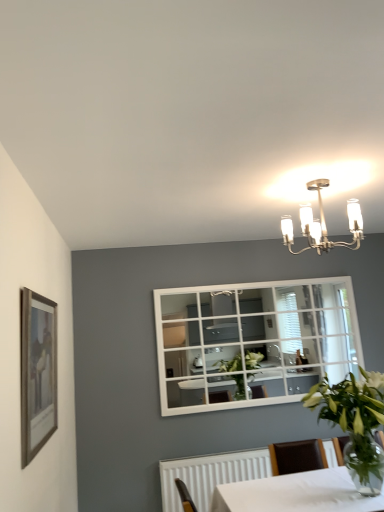
You are a GUI agent. You are given a task and a screenshot of the screen. Output one action in this format:
    pyautogui.click(x=<x>, y=<y>)
    Task: Click on the satin nickel chandelier at upper center
    
    Given the screenshot: What is the action you would take?
    pyautogui.click(x=322, y=224)

Measure the distance between wooden framed picture at left and camera.

wooden framed picture at left is 1.73 meters away from camera.

Locate an element on the screen. The width and height of the screenshot is (384, 512). satin nickel chandelier at upper center is located at coordinates (322, 224).

Considering the relative positions of wooden framed picture at left and green leafy plant in clear glass vase at lower right in the image provided, is wooden framed picture at left to the left of green leafy plant in clear glass vase at lower right from the viewer's perspective?

Yes.

Between wooden framed picture at left and green leafy plant in clear glass vase at lower right, which one has smaller size?

With smaller size is wooden framed picture at left.

How many degrees apart are the facing directions of wooden framed picture at left and green leafy plant in clear glass vase at lower right?

The angular difference between wooden framed picture at left and green leafy plant in clear glass vase at lower right is 90.8 degrees.

Considering the sizes of objects wooden framed picture at left and green leafy plant in clear glass vase at lower right in the image provided, who is shorter, wooden framed picture at left or green leafy plant in clear glass vase at lower right?

Standing shorter between the two is green leafy plant in clear glass vase at lower right.

From the image's perspective, between green leafy plant in clear glass vase at lower right and wooden framed picture at left, who is located below?

From the image's view, green leafy plant in clear glass vase at lower right is below.

Which object is positioned more to the right, green leafy plant in clear glass vase at lower right or wooden framed picture at left?

green leafy plant in clear glass vase at lower right.

Considering the sizes of green leafy plant in clear glass vase at lower right and wooden framed picture at left in the image, is green leafy plant in clear glass vase at lower right bigger or smaller than wooden framed picture at left?

In the image, green leafy plant in clear glass vase at lower right appears to be larger than wooden framed picture at left.

Considering the sizes of satin nickel chandelier at upper center and wooden framed picture at left in the image, is satin nickel chandelier at upper center wider or thinner than wooden framed picture at left?

Clearly, satin nickel chandelier at upper center has more width compared to wooden framed picture at left.

In terms of height, does satin nickel chandelier at upper center look taller or shorter compared to wooden framed picture at left?

Clearly, satin nickel chandelier at upper center is shorter compared to wooden framed picture at left.

From the image's perspective, between satin nickel chandelier at upper center and wooden framed picture at left, who is located below?

wooden framed picture at left, from the image's perspective.

Are satin nickel chandelier at upper center and wooden framed picture at left making contact?

There is a gap between satin nickel chandelier at upper center and wooden framed picture at left.

Is point (49, 408) farther from viewer compared to point (326, 226)?

No, it is in front of (326, 226).

Where is `lamp that appears above the wooden framed picture at left (from the image's perspective)`? The width and height of the screenshot is (384, 512). lamp that appears above the wooden framed picture at left (from the image's perspective) is located at coordinates (322, 224).

Is wooden framed picture at left bigger or smaller than satin nickel chandelier at upper center?

wooden framed picture at left is smaller than satin nickel chandelier at upper center.

From a real-world perspective, does wooden framed picture at left sit lower than satin nickel chandelier at upper center?

Yes, from a real-world perspective, wooden framed picture at left is below satin nickel chandelier at upper center.

From the image's perspective, which object appears higher, green leafy plant in clear glass vase at lower right or satin nickel chandelier at upper center?

satin nickel chandelier at upper center.

Who is bigger, green leafy plant in clear glass vase at lower right or satin nickel chandelier at upper center?

green leafy plant in clear glass vase at lower right is bigger.

Is green leafy plant in clear glass vase at lower right closer to camera compared to satin nickel chandelier at upper center?

Yes, it is in front of satin nickel chandelier at upper center.

Which is less distant, (284, 230) or (364, 439)?

Point (284, 230) appears to be farther away from the viewer than point (364, 439).

Can you confirm if satin nickel chandelier at upper center is positioned to the right of green leafy plant in clear glass vase at lower right?

No.

Where is `picture frame that appears above the green leafy plant in clear glass vase at lower right (from the image's perspective)`? This screenshot has width=384, height=512. picture frame that appears above the green leafy plant in clear glass vase at lower right (from the image's perspective) is located at coordinates (37, 372).

This screenshot has width=384, height=512. I want to click on houseplant directly beneath the wooden framed picture at left (from a real-world perspective), so click(355, 423).

Considering their positions, is green leafy plant in clear glass vase at lower right positioned further to satin nickel chandelier at upper center than wooden framed picture at left?

wooden framed picture at left lies further to satin nickel chandelier at upper center than the other object.

Estimate the real-world distances between objects in this image. Which object is closer to wooden framed picture at left, green leafy plant in clear glass vase at lower right or satin nickel chandelier at upper center?

The object closer to wooden framed picture at left is green leafy plant in clear glass vase at lower right.

Which object lies further to the anchor point wooden framed picture at left, satin nickel chandelier at upper center or green leafy plant in clear glass vase at lower right?

satin nickel chandelier at upper center.

Based on the photo, based on their spatial positions, is wooden framed picture at left or satin nickel chandelier at upper center closer to green leafy plant in clear glass vase at lower right?

satin nickel chandelier at upper center lies closer to green leafy plant in clear glass vase at lower right than the other object.

Estimate the real-world distances between objects in this image. Which object is closer to green leafy plant in clear glass vase at lower right, satin nickel chandelier at upper center or wooden framed picture at left?

satin nickel chandelier at upper center.

Which object lies nearer to the anchor point satin nickel chandelier at upper center, wooden framed picture at left or green leafy plant in clear glass vase at lower right?

Based on the image, green leafy plant in clear glass vase at lower right appears to be nearer to satin nickel chandelier at upper center.

What are the coordinates of `lamp situated between wooden framed picture at left and green leafy plant in clear glass vase at lower right from left to right` in the screenshot? It's located at (322, 224).